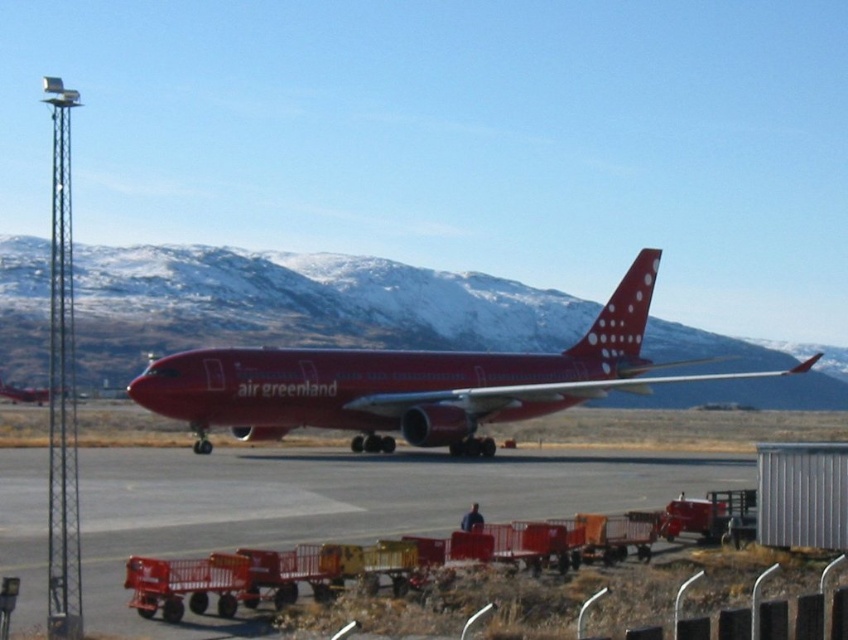
This screenshot has height=640, width=848. What do you see at coordinates (339, 502) in the screenshot?
I see `metallic gray tarmac at center` at bounding box center [339, 502].

Where is `metallic gray tarmac at center`? This screenshot has width=848, height=640. metallic gray tarmac at center is located at coordinates (339, 502).